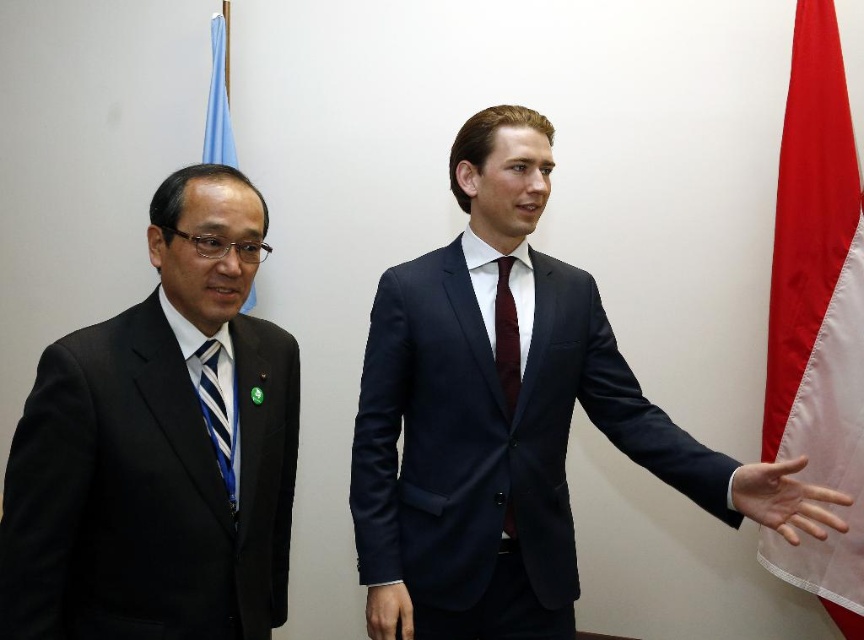
You are a photographer at a conference. You need to capture a candid shot of the blue striped tie at left and the smooth skin hand at center. Based on their positions, which object is located to the right of the other?

The smooth skin hand at center is positioned on the right side of blue striped tie at left, so the smooth skin hand at center is to the right of the blue striped tie at left.

You are attending a formal event and notice a blue fabric flag at upper left and a burgundy silk tie at center. Which object is positioned higher in the image?

The blue fabric flag at upper left is positioned higher than the burgundy silk tie at center in the image.

You are standing in a formal indoor setting with two people. There is a point labeled as point (218,99). What object is located at that point?

The point (218,99) corresponds to the blue fabric flag at upper left.